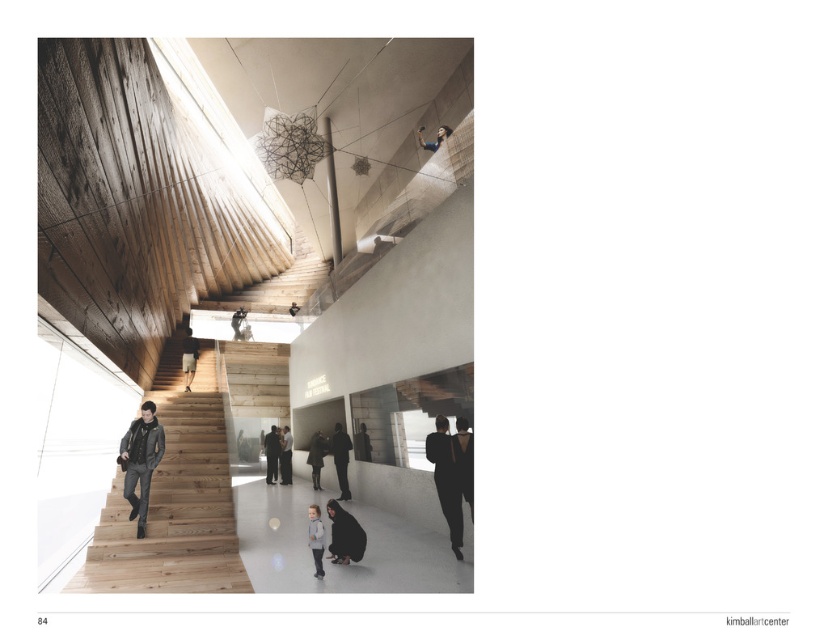
Question: Which of these objects is positioned closest to the dark gray jacket at lower center?

Choices:
 (A) dark brown leather jacket at lower right
 (B) natural wood stairs at lower left

Answer: (B)

Question: Which point is closer to the camera?

Choices:
 (A) dark gray pants at lower center
 (B) light gray sweater at center

Answer: (B)

Question: Is dark gray suit at center further to camera compared to matte black jacket at upper center?

Choices:
 (A) yes
 (B) no

Answer: (A)

Question: Can you confirm if natural wood stairs at lower left is thinner than dark gray pants at lower center?

Choices:
 (A) yes
 (B) no

Answer: (A)

Question: Which of the following is the farthest from the observer?

Choices:
 (A) matte gray jacket at center
 (B) natural wood stairs at lower left

Answer: (A)

Question: Does dark gray jacket at lower center have a smaller size compared to matte black jacket at upper center?

Choices:
 (A) no
 (B) yes

Answer: (B)